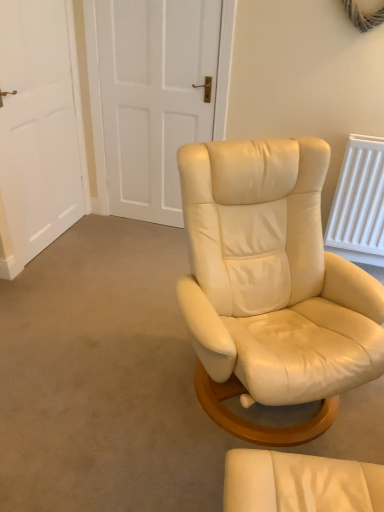
Image resolution: width=384 pixels, height=512 pixels. What are the coordinates of `unoccupied space behind matte cream leather chair at center` in the screenshot? It's located at (275, 436).